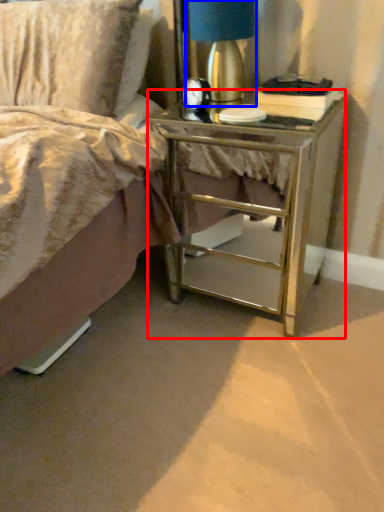
Question: Which point is closer to the camera, nightstand (highlighted by a red box) or bedside lamp (highlighted by a blue box)?

Choices:
 (A) nightstand
 (B) bedside lamp

Answer: (A)